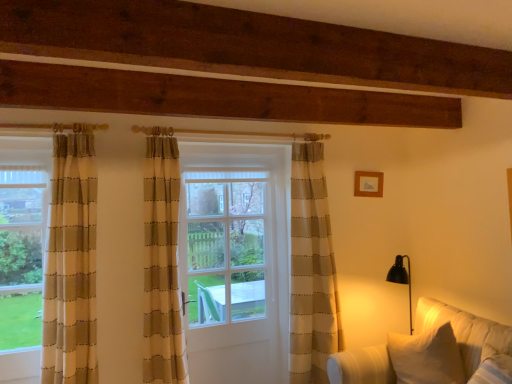
This screenshot has width=512, height=384. I want to click on wooden picture frame at upper right, so click(368, 184).

The width and height of the screenshot is (512, 384). Describe the element at coordinates (303, 255) in the screenshot. I see `white wooden door at center` at that location.

What do you see at coordinates (464, 330) in the screenshot? The height and width of the screenshot is (384, 512). I see `white fabric couch at lower right` at bounding box center [464, 330].

You are a GUI agent. You are given a task and a screenshot of the screen. Output one action in this format:
    pyautogui.click(x=<x>, y=<y>)
    Task: Click on the clear glass door at center
    
    Given the screenshot: What is the action you would take?
    pyautogui.click(x=225, y=246)

Choose the correct answer: Is beige striped curtains at left inside white wooden door at center or outside it?

The correct answer is: outside.

Considering the positions of objects beige striped curtains at left and white wooden door at center in the image provided, who is more to the right, beige striped curtains at left or white wooden door at center?

Positioned to the right is white wooden door at center.

Is beige striped curtains at left taller than white wooden door at center?

No, beige striped curtains at left is not taller than white wooden door at center.

Considering the sizes of objects white fabric couch at lower right and clear glass door at center in the image provided, who is thinner, white fabric couch at lower right or clear glass door at center?

clear glass door at center is thinner.

Does white fabric couch at lower right have a larger size compared to clear glass door at center?

Correct, white fabric couch at lower right is larger in size than clear glass door at center.

In the image, there is a clear glass door at center. Where is `studio couch below it (from the image's perspective)`? The image size is (512, 384). studio couch below it (from the image's perspective) is located at coordinates (464, 330).

Is white fabric couch at lower right inside or outside of clear glass door at center?

white fabric couch at lower right is not enclosed by clear glass door at center.

From their relative heights in the image, would you say clear glass door at center is taller or shorter than beige striped curtains at left?

clear glass door at center is taller than beige striped curtains at left.

From the image's perspective, which object appears higher, clear glass door at center or beige striped curtains at left?

beige striped curtains at left, from the image's perspective.

Is beige striped curtains at left inside clear glass door at center?

Actually, beige striped curtains at left is outside clear glass door at center.

Which object is more forward, clear glass door at center or beige striped curtains at left?

beige striped curtains at left is more forward.

Considering the relative sizes of wooden picture frame at upper right and white wooden door at center in the image provided, is wooden picture frame at upper right smaller than white wooden door at center?

Correct, wooden picture frame at upper right occupies less space than white wooden door at center.

Consider the image. From a real-world perspective, which is physically above, wooden picture frame at upper right or white wooden door at center?

wooden picture frame at upper right, from a real-world perspective.

Which object is closer to the camera taking this photo, wooden picture frame at upper right or white wooden door at center?

white wooden door at center.

Considering the sizes of objects clear glass door at center and white wooden door at center in the image provided, who is thinner, clear glass door at center or white wooden door at center?

clear glass door at center is thinner.

You are a GUI agent. You are given a task and a screenshot of the screen. Output one action in this format:
    pyautogui.click(x=<x>, y=<y>)
    Task: Click on the door located on the right of clear glass door at center
    This screenshot has height=384, width=512.
    Given the screenshot: What is the action you would take?
    pyautogui.click(x=303, y=255)

Is clear glass door at center not near white wooden door at center?

No, clear glass door at center is in close proximity to white wooden door at center.

From their relative heights in the image, would you say clear glass door at center is taller or shorter than white wooden door at center?

Considering their sizes, clear glass door at center has less height than white wooden door at center.

Considering the sizes of objects white fabric couch at lower right and beige striped curtains at left in the image provided, who is taller, white fabric couch at lower right or beige striped curtains at left?

With more height is beige striped curtains at left.

Is white fabric couch at lower right smaller than beige striped curtains at left?

Incorrect, white fabric couch at lower right is not smaller in size than beige striped curtains at left.

From the picture: Which object is positioned more to the left, white fabric couch at lower right or beige striped curtains at left?

beige striped curtains at left.

Is white fabric couch at lower right closer to camera compared to beige striped curtains at left?

Yes, it is.

In the scene shown: How far apart are wooden picture frame at upper right and clear glass door at center?

They are 1.05 meters apart.

Is wooden picture frame at upper right positioned beyond the bounds of clear glass door at center?

Yes, wooden picture frame at upper right is located beyond the bounds of clear glass door at center.

Is wooden picture frame at upper right far away from clear glass door at center?

Yes.

Looking at this image, which object is positioned more to the right, wooden picture frame at upper right or clear glass door at center?

From the viewer's perspective, wooden picture frame at upper right appears more on the right side.

I want to click on door located behind the beige striped curtains at left, so click(303, 255).

Locate an element on the screen. window screen located above the white fabric couch at lower right (from the image's perspective) is located at coordinates (225, 246).

Which object lies further to the anchor point clear glass door at center, white fabric couch at lower right or white wooden door at center?

The object further to clear glass door at center is white fabric couch at lower right.

Considering their positions, is wooden picture frame at upper right positioned further to white wooden door at center than white fabric couch at lower right?

white fabric couch at lower right is further to white wooden door at center.

Looking at the image, which one is located closer to clear glass door at center, white wooden door at center or wooden picture frame at upper right?

white wooden door at center.

Which object lies nearer to the anchor point wooden picture frame at upper right, beige striped curtains at left or white wooden door at center?

white wooden door at center.

Looking at the image, which one is located closer to wooden picture frame at upper right, clear glass door at center or white wooden door at center?

white wooden door at center is closer to wooden picture frame at upper right.

Based on their spatial positions, is white fabric couch at lower right or wooden picture frame at upper right further from white wooden door at center?

white fabric couch at lower right.

Considering their positions, is beige striped curtains at left positioned closer to white fabric couch at lower right than clear glass door at center?

clear glass door at center is closer to white fabric couch at lower right.

Which object lies further to the anchor point clear glass door at center, beige striped curtains at left or white wooden door at center?

beige striped curtains at left is positioned further to the anchor clear glass door at center.

You are a GUI agent. You are given a task and a screenshot of the screen. Output one action in this format:
    pyautogui.click(x=<x>, y=<y>)
    Task: Click on the window screen between beige striped curtains at left and wooden picture frame at upper right from left to right
    This screenshot has height=384, width=512.
    Given the screenshot: What is the action you would take?
    pyautogui.click(x=225, y=246)

Find the location of a particular element. This screenshot has width=512, height=384. door between white fabric couch at lower right and wooden picture frame at upper right in the front-back direction is located at coordinates (303, 255).

Where is `window screen positioned between white fabric couch at lower right and wooden picture frame at upper right from near to far`? This screenshot has height=384, width=512. window screen positioned between white fabric couch at lower right and wooden picture frame at upper right from near to far is located at coordinates (225, 246).

Image resolution: width=512 pixels, height=384 pixels. In order to click on door located between clear glass door at center and wooden picture frame at upper right in the left-right direction in this screenshot , I will do `click(303, 255)`.